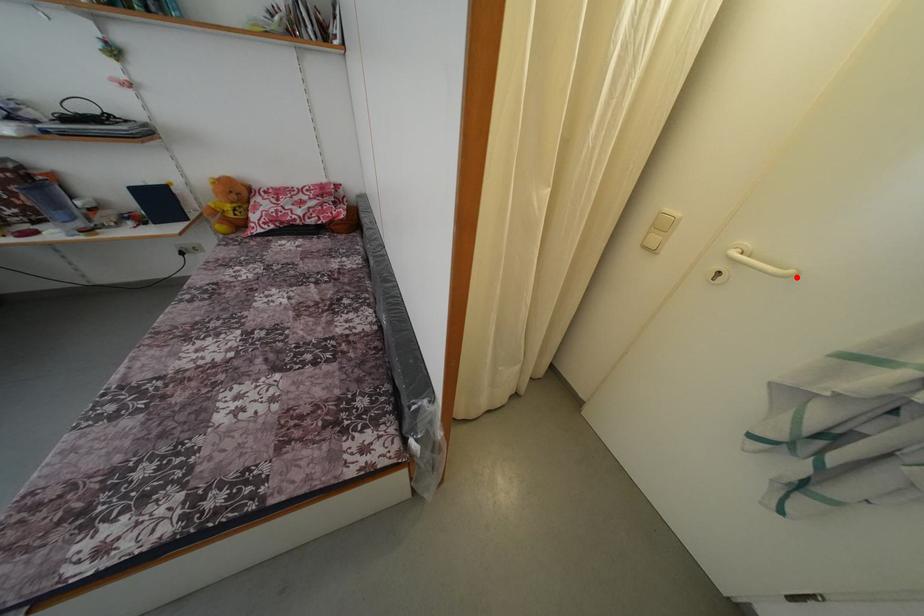
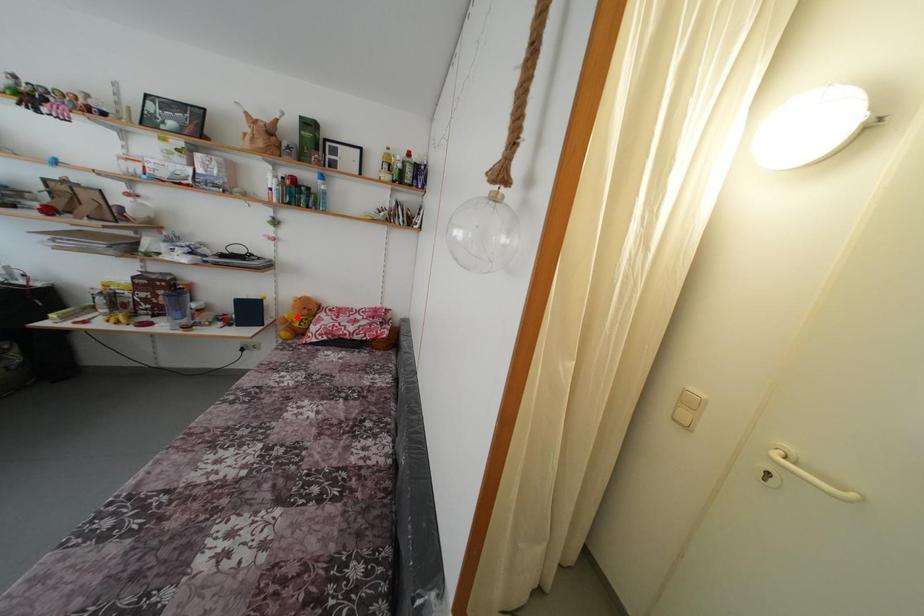
I am providing you with two images of the same scene from different viewpoints. A red point is marked on the first image and another point is marked on the second image. Is the red point in image1 aligned with the point shown in image2?

No